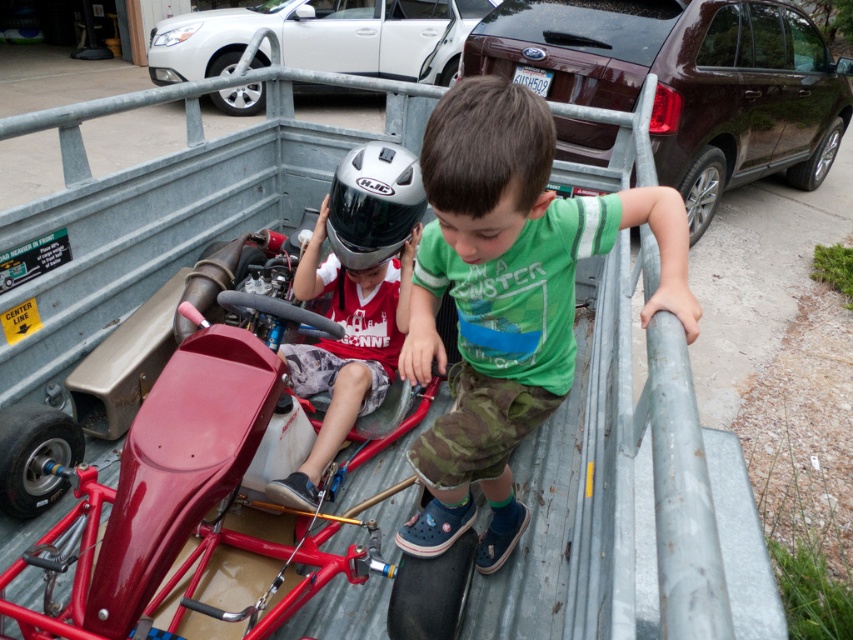
You are a delivery robot with a package that needs to be placed between the green cotton shirt at center and the silver metallic helmet at center. The package is 25 inches long. Will it fit in the space between them?

The distance between the green cotton shirt at center and the silver metallic helmet at center is 27.34 inches. Since the package is 25 inches long, it will fit in the space between them.

You are a delivery person trying to load a box that is 1 meter tall into the bed of the pickup truck. The box must be placed between the brown metallic suv at upper right and the silver metallic helmet at center. Can the box fit vertically between them?

The brown metallic suv at upper right is taller than the silver metallic helmet at center. The vertical space between them is determined by their height difference. Since the box is 1 meter tall, it may not fit if the vertical clearance is less than 1 meter. However, without exact measurements of the space between them, it is uncertain if the box will fit vertically.